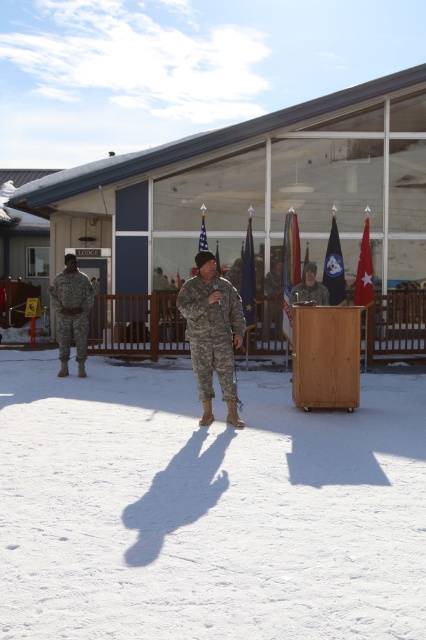
Based on the photo, can you confirm if red fabric flag at center is positioned to the right of matte khaki uniform at center?

Correct, you'll find red fabric flag at center to the right of matte khaki uniform at center.

Describe the element at coordinates (363, 272) in the screenshot. I see `red fabric flag at center` at that location.

Identify the location of red fabric flag at center. (363, 272).

The height and width of the screenshot is (640, 426). I want to click on red fabric flag at center, so click(x=363, y=272).

Consider the image. Between white powdery snow at center and blue fabric flag at center, which one appears on the right side from the viewer's perspective?

Positioned to the right is blue fabric flag at center.

Can you confirm if white powdery snow at center is positioned to the right of blue fabric flag at center?

Incorrect, white powdery snow at center is not on the right side of blue fabric flag at center.

Who is more distant from viewer, (176, 429) or (250, 220)?

Positioned behind is point (250, 220).

Identify the location of white powdery snow at center. (207, 508).

Who is more distant from viewer, (x=39, y=595) or (x=212, y=362)?

The point (x=212, y=362) is behind.

Is point (291, 598) behind point (210, 387)?

No, it is in front of (210, 387).

Identify the location of white powdery snow at center. (207, 508).